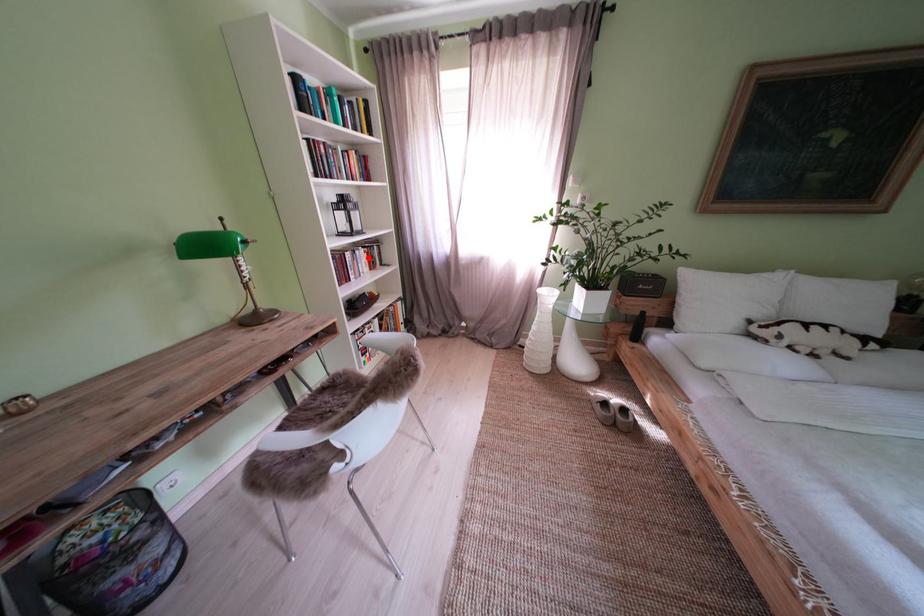
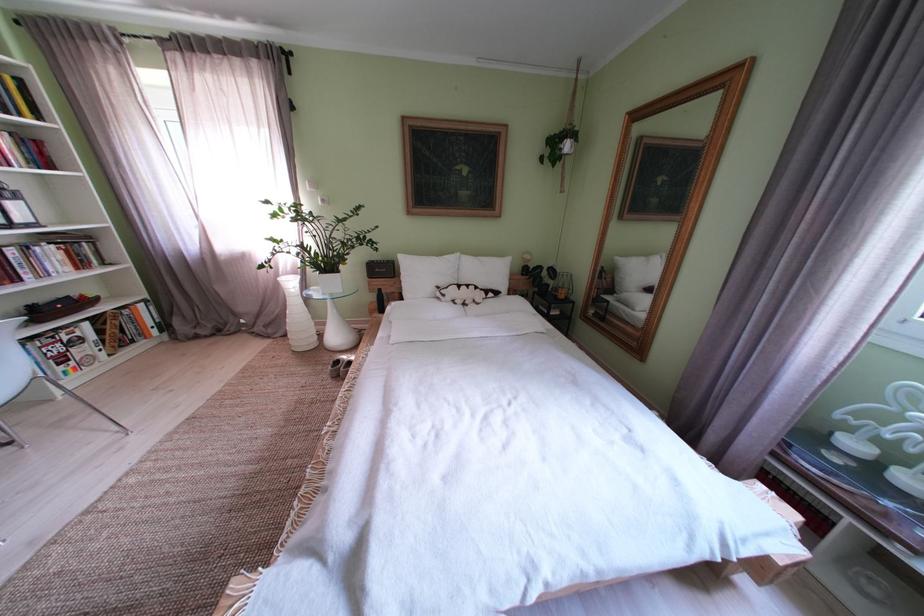
Question: I am providing you with two images of the same scene from different viewpoints. Given a red point in image1, look at the same physical point in image2. Is it:

Choices:
 (A) Closer to the viewpoint
 (B) Farther from the viewpoint

Answer: (B)